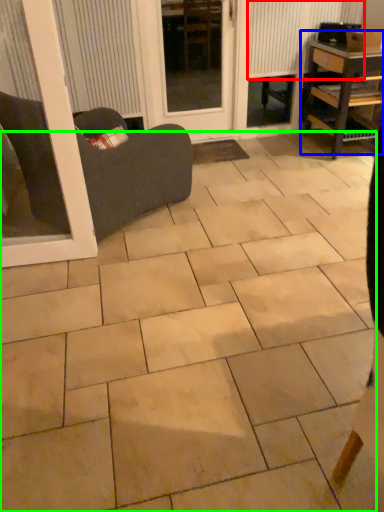
Question: Based on their relative distances, which object is nearer to radiator (highlighted by a red box)? Choose from table (highlighted by a blue box) and ceramic tile (highlighted by a green box).

Choices:
 (A) table
 (B) ceramic tile

Answer: (A)